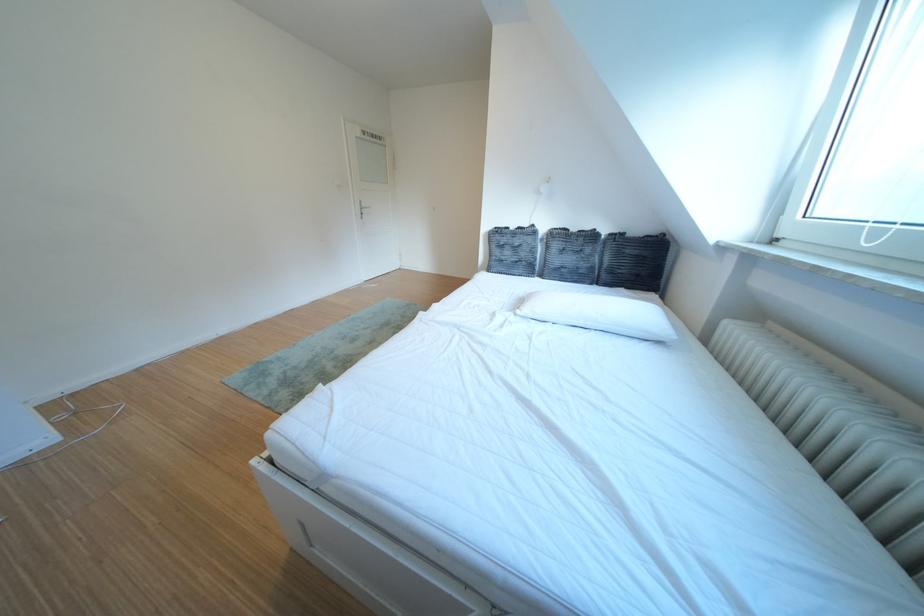
Where would you push the white light switch? Please return your answer as a coordinate pair (x, y).

(543, 188)